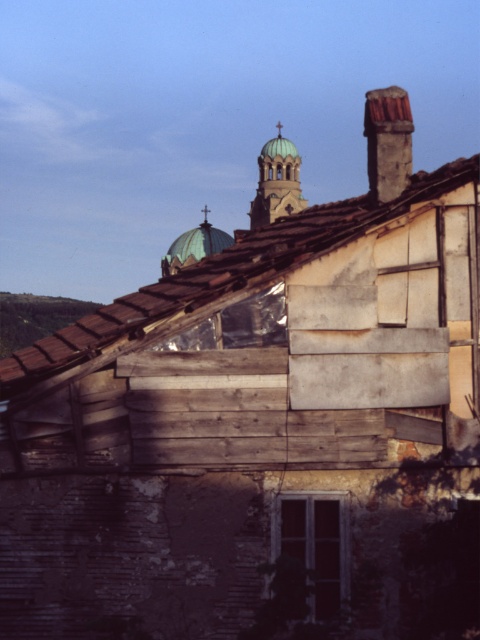
Which is behind, point (454, 164) or point (264, 195)?

The point (264, 195) is behind.

Identify the location of brown shingles at upper left. The height and width of the screenshot is (640, 480). (222, 275).

Locate an element on the screen. The width and height of the screenshot is (480, 640). brown shingles at upper left is located at coordinates (222, 275).

Describe the element at coordinates (222, 275) in the screenshot. I see `brown shingles at upper left` at that location.

Is point (94, 328) in front of point (391, 138)?

No, (94, 328) is further to viewer.

The image size is (480, 640). In order to click on brown shingles at upper left in this screenshot , I will do `click(222, 275)`.

Is rusty metal chimney at upper right smaller than green glazed dome at upper center?

Incorrect, rusty metal chimney at upper right is not smaller in size than green glazed dome at upper center.

Is rusty metal chimney at upper right taller than green glazed dome at upper center?

Correct, rusty metal chimney at upper right is much taller as green glazed dome at upper center.

What do you see at coordinates (387, 141) in the screenshot? I see `rusty metal chimney at upper right` at bounding box center [387, 141].

Find the location of a particular element. rusty metal chimney at upper right is located at coordinates (387, 141).